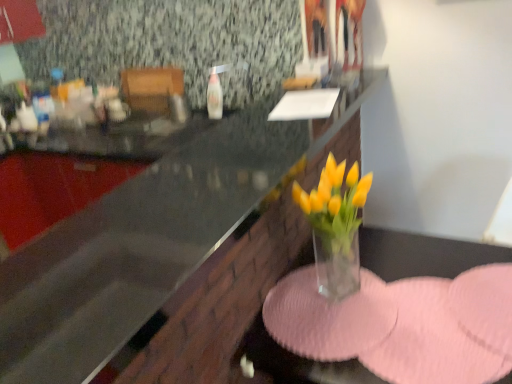
The width and height of the screenshot is (512, 384). What do you see at coordinates (142, 244) in the screenshot?
I see `transparent glass countertop at center` at bounding box center [142, 244].

Locate an element on the screen. transparent glass countertop at center is located at coordinates (142, 244).

The width and height of the screenshot is (512, 384). Describe the element at coordinates (422, 255) in the screenshot. I see `transparent glass vase at center` at that location.

What are the coordinates of `transparent glass vase at center` in the screenshot? It's located at (422, 255).

This screenshot has height=384, width=512. Identify the location of transparent glass countertop at center. (142, 244).

Is transparent glass countertop at center to the left of transparent glass vase at center from the viewer's perspective?

Correct, you'll find transparent glass countertop at center to the left of transparent glass vase at center.

Considering their positions, is transparent glass countertop at center located in front of or behind transparent glass vase at center?

transparent glass countertop at center is positioned closer to the viewer than transparent glass vase at center.

Between point (127, 281) and point (386, 279), which one is positioned in front?

Point (127, 281)

From the image's perspective, does transparent glass countertop at center appear lower than transparent glass vase at center?

No.

From a real-world perspective, who is located higher, transparent glass countertop at center or transparent glass vase at center?

transparent glass countertop at center, from a real-world perspective.

Considering the sizes of objects transparent glass countertop at center and transparent glass vase at center in the image provided, who is thinner, transparent glass countertop at center or transparent glass vase at center?

With smaller width is transparent glass vase at center.

Considering the sizes of transparent glass countertop at center and transparent glass vase at center in the image, is transparent glass countertop at center taller or shorter than transparent glass vase at center?

Considering their sizes, transparent glass countertop at center has less height than transparent glass vase at center.

Between transparent glass countertop at center and transparent glass vase at center, which one has smaller size?

transparent glass countertop at center is smaller.

Is transparent glass countertop at center spatially inside transparent glass vase at center, or outside of it?

transparent glass countertop at center is located beyond the bounds of transparent glass vase at center.

Is there a large distance between transparent glass countertop at center and transparent glass vase at center?

That's not correct — transparent glass countertop at center is a little close to transparent glass vase at center.

Is transparent glass vase at center at the back of transparent glass countertop at center?

No, transparent glass vase at center is not at the back of transparent glass countertop at center.

Measure the distance between transparent glass countertop at center and transparent glass vase at center.

transparent glass countertop at center is 19.34 inches away from transparent glass vase at center.

In the image, there is a transparent glass countertop at center. Where is `table below it (from a real-world perspective)`? The image size is (512, 384). table below it (from a real-world perspective) is located at coordinates (422, 255).

Visually, is transparent glass vase at center positioned to the left or to the right of transparent glass countertop at center?

transparent glass vase at center is positioned on transparent glass countertop at center's right side.

Which object is closer to the camera, transparent glass vase at center or transparent glass countertop at center?

transparent glass countertop at center is in front.

Which is behind, point (508, 255) or point (12, 342)?

The point (508, 255) is farther from the camera.

From the image's perspective, which one is positioned higher, transparent glass vase at center or transparent glass countertop at center?

transparent glass countertop at center appears higher in the image.

From a real-world perspective, between transparent glass vase at center and transparent glass countertop at center, who is vertically lower?

transparent glass vase at center.

Does transparent glass vase at center have a greater width compared to transparent glass countertop at center?

No, transparent glass vase at center is not wider than transparent glass countertop at center.

Is transparent glass vase at center taller than transparent glass countertop at center?

Yes.

Considering the sizes of objects transparent glass vase at center and transparent glass countertop at center in the image provided, who is smaller, transparent glass vase at center or transparent glass countertop at center?

transparent glass countertop at center.

Is transparent glass vase at center inside or outside of transparent glass countertop at center?

transparent glass vase at center is located beyond the bounds of transparent glass countertop at center.

Can you see transparent glass vase at center touching transparent glass countertop at center?

transparent glass vase at center and transparent glass countertop at center are not in contact.

Is transparent glass countertop at center at the back of transparent glass vase at center?

No, transparent glass countertop at center is not at the back of transparent glass vase at center.

Can you tell me how much transparent glass vase at center and transparent glass countertop at center differ in facing direction?

The angle between the facing direction of transparent glass vase at center and the facing direction of transparent glass countertop at center is 90.5 degrees.

I want to click on countertop in front of the transparent glass vase at center, so click(x=142, y=244).

This screenshot has width=512, height=384. Identify the location of table that appears behind the transparent glass countertop at center. (422, 255).

Find the location of `countertop on the left side of transparent glass vase at center`. countertop on the left side of transparent glass vase at center is located at coordinates (142, 244).